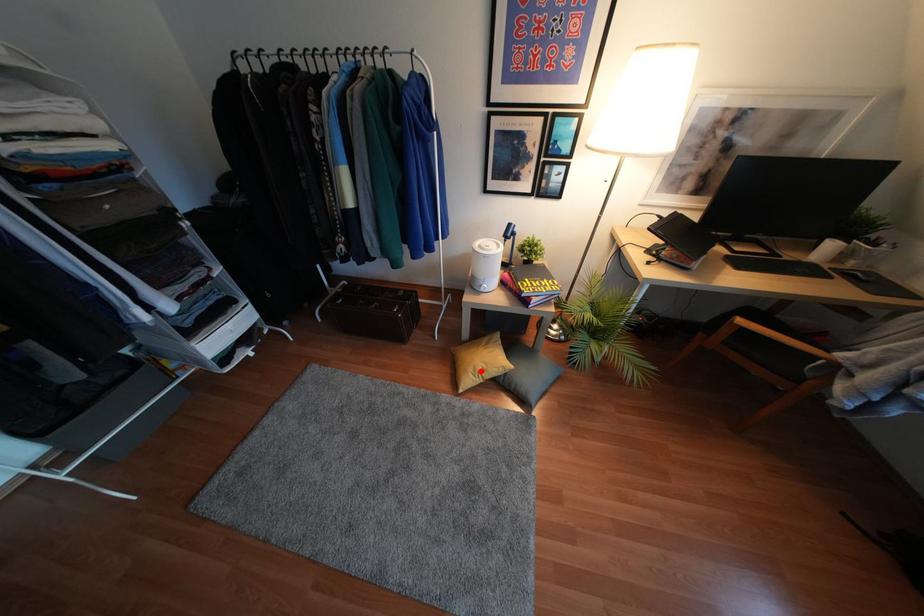
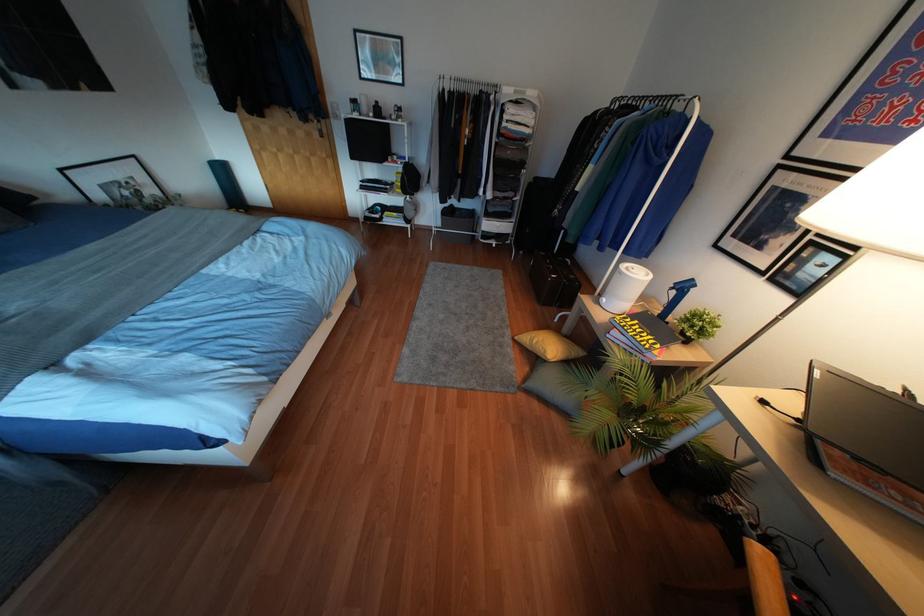
Question: I am providing you with two images of the same scene from different viewpoints. A red point is shown in image1. For the corresponding object point in image2, is it positioned nearer or farther from the camera?

Choices:
 (A) Nearer
 (B) Farther

Answer: (A)